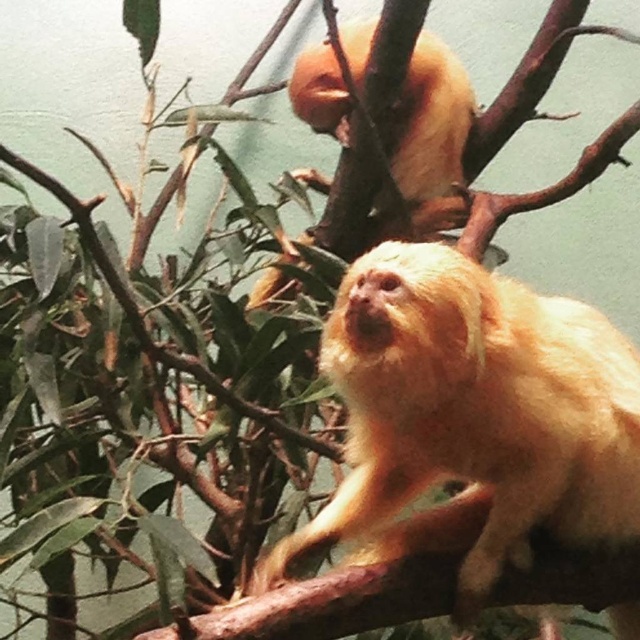
Question: Does golden fur monkey at center appear on the left side of golden fur monkey at upper center?

Choices:
 (A) no
 (B) yes

Answer: (A)

Question: Is the position of golden fur monkey at center more distant than that of golden fur monkey at upper center?

Choices:
 (A) no
 (B) yes

Answer: (A)

Question: Observing the image, what is the correct spatial positioning of golden fur monkey at center in reference to golden fur monkey at upper center?

Choices:
 (A) above
 (B) below

Answer: (B)

Question: Which of the following is the closest to the observer?

Choices:
 (A) golden fur monkey at upper center
 (B) golden fur monkey at center

Answer: (B)